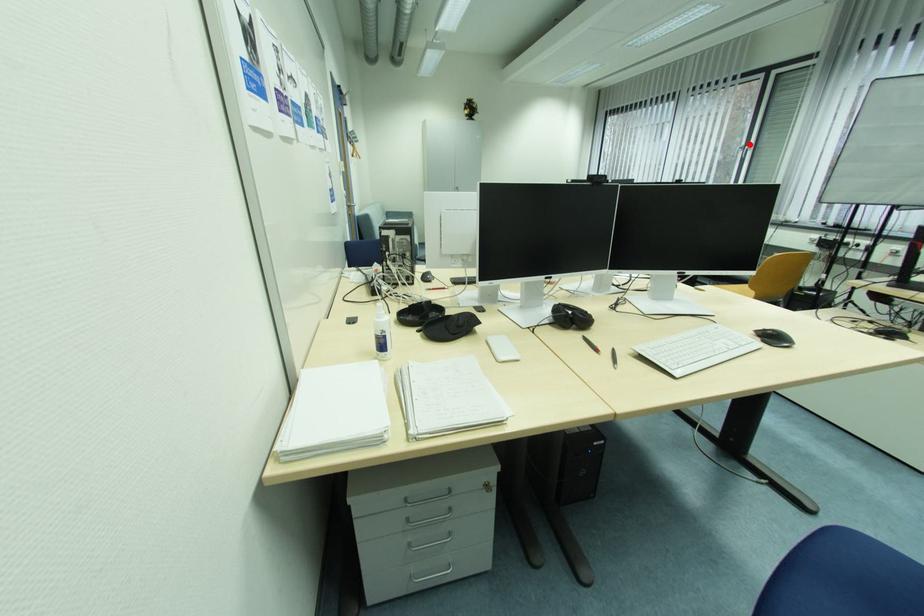
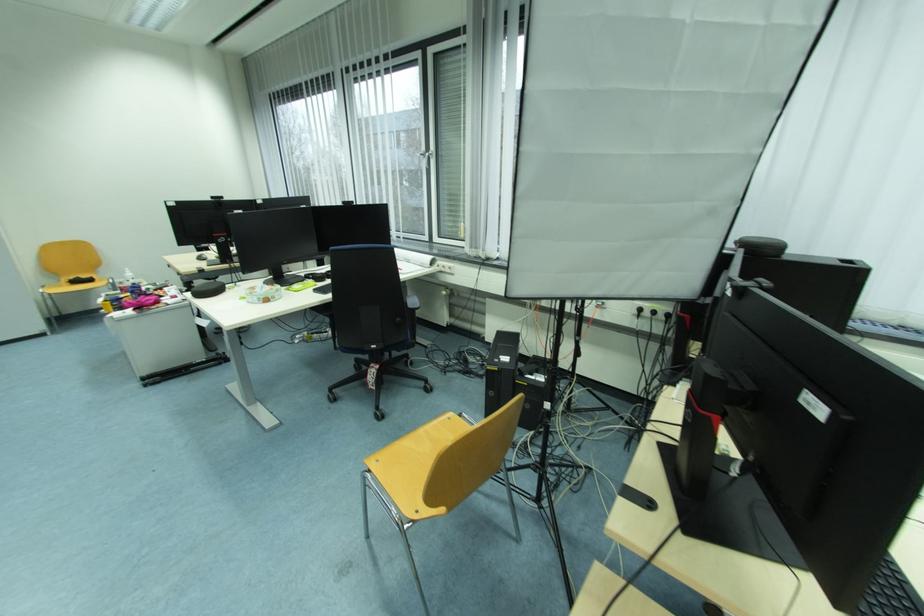
Question: I am providing you with two images of the same scene from different viewpoints. Image1 has a red point marked. In image2, the corresponding 3D location appears at what relative position? Reply with the corresponding letter.

Choices:
 (A) Closer
 (B) Farther

Answer: (A)